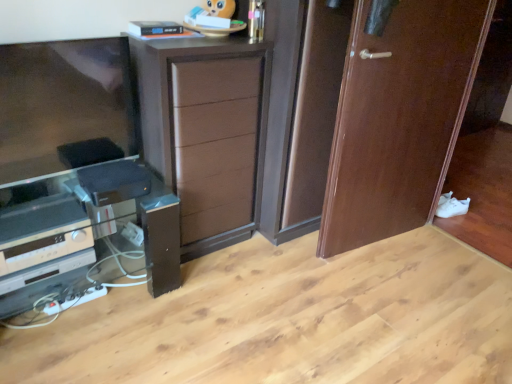
Question: Does white matte shoe at lower right have a lesser height compared to brown wood chest of drawers at center?

Choices:
 (A) no
 (B) yes

Answer: (B)

Question: Is white matte shoe at lower right bigger than brown wood chest of drawers at center?

Choices:
 (A) yes
 (B) no

Answer: (B)

Question: Is white matte shoe at lower right facing towards brown wood chest of drawers at center?

Choices:
 (A) yes
 (B) no

Answer: (A)

Question: Is white matte shoe at lower right at the right side of brown wood chest of drawers at center?

Choices:
 (A) no
 (B) yes

Answer: (B)

Question: From a real-world perspective, is white matte shoe at lower right below brown wood chest of drawers at center?

Choices:
 (A) no
 (B) yes

Answer: (B)

Question: From a real-world perspective, relative to brown wood chest of drawers at center, is wooden door at right vertically above or below?

Choices:
 (A) below
 (B) above

Answer: (B)

Question: Is point (431, 200) closer or farther from the camera than point (170, 140)?

Choices:
 (A) closer
 (B) farther

Answer: (B)

Question: Based on their sizes in the image, would you say wooden door at right is bigger or smaller than brown wood chest of drawers at center?

Choices:
 (A) small
 (B) big

Answer: (A)

Question: From the image's perspective, is wooden door at right above or below brown wood chest of drawers at center?

Choices:
 (A) below
 (B) above

Answer: (B)

Question: Looking at their shapes, would you say white matte shoe at lower right is wider or thinner than brown wood chest of drawers at center?

Choices:
 (A) thin
 (B) wide

Answer: (A)

Question: In the image, is white matte shoe at lower right on the left side or the right side of brown wood chest of drawers at center?

Choices:
 (A) left
 (B) right

Answer: (B)

Question: Is white matte shoe at lower right spatially inside brown wood chest of drawers at center, or outside of it?

Choices:
 (A) inside
 (B) outside

Answer: (B)

Question: Based on their sizes in the image, would you say white matte shoe at lower right is bigger or smaller than brown wood chest of drawers at center?

Choices:
 (A) small
 (B) big

Answer: (A)

Question: From the image's perspective, is brown wood chest of drawers at center located above or below wooden door at right?

Choices:
 (A) above
 (B) below

Answer: (B)

Question: Is brown wood chest of drawers at center taller or shorter than wooden door at right?

Choices:
 (A) short
 (B) tall

Answer: (A)